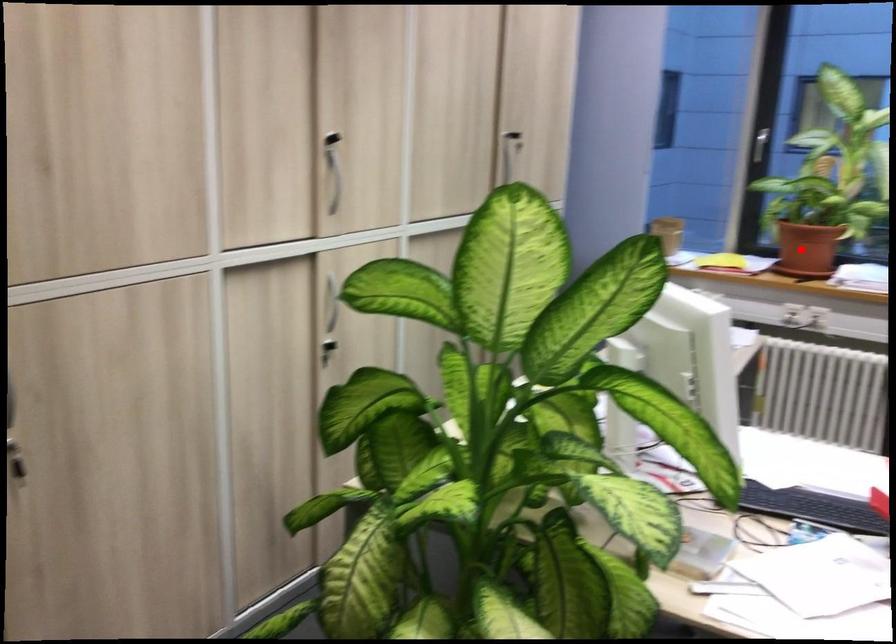
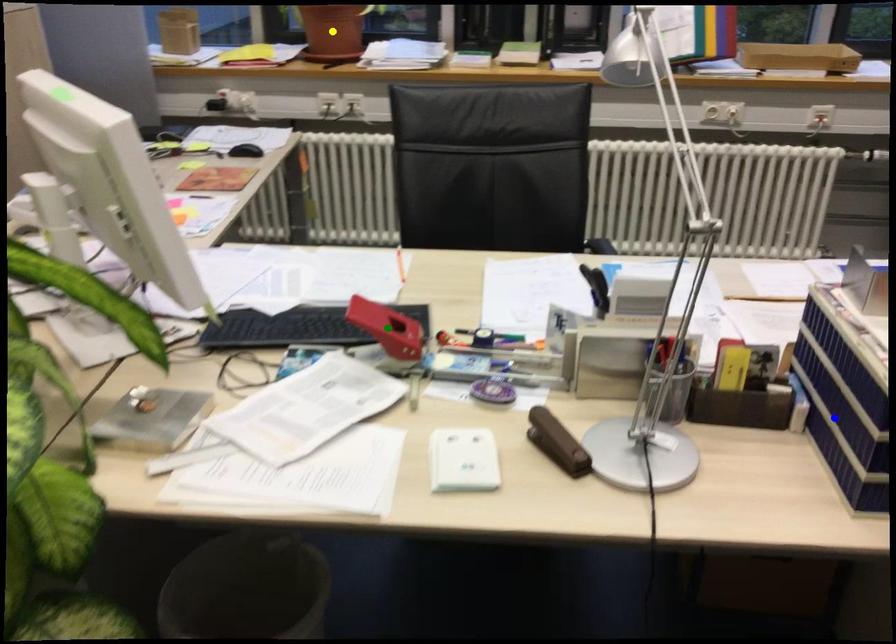
Question: I am providing you with two images of the same scene from different viewpoints. A red point is marked on the first image. You are given multiple points on the second image. Which spot in image 2 lines up with the point in image 1?

Choices:
 (A) green point
 (B) yellow point
 (C) blue point

Answer: (B)